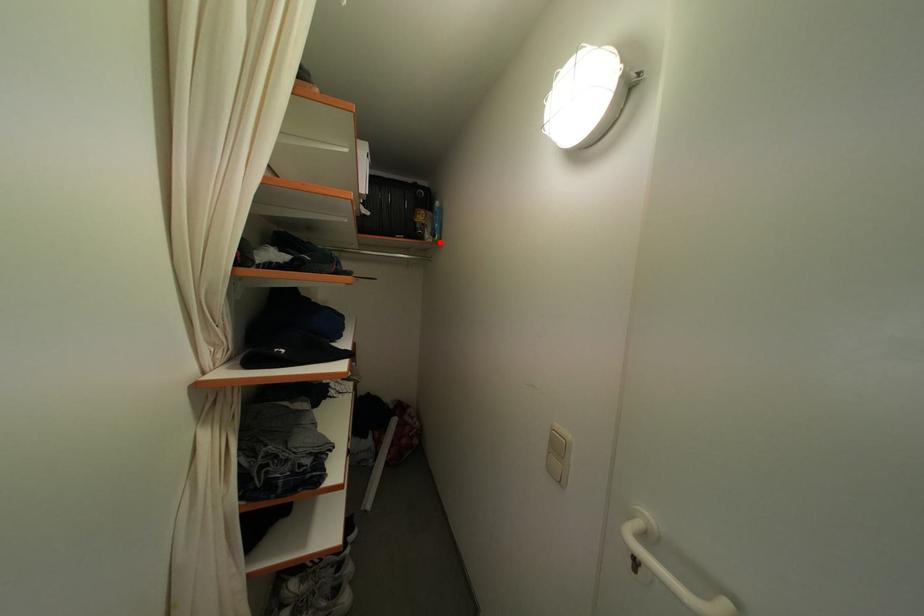
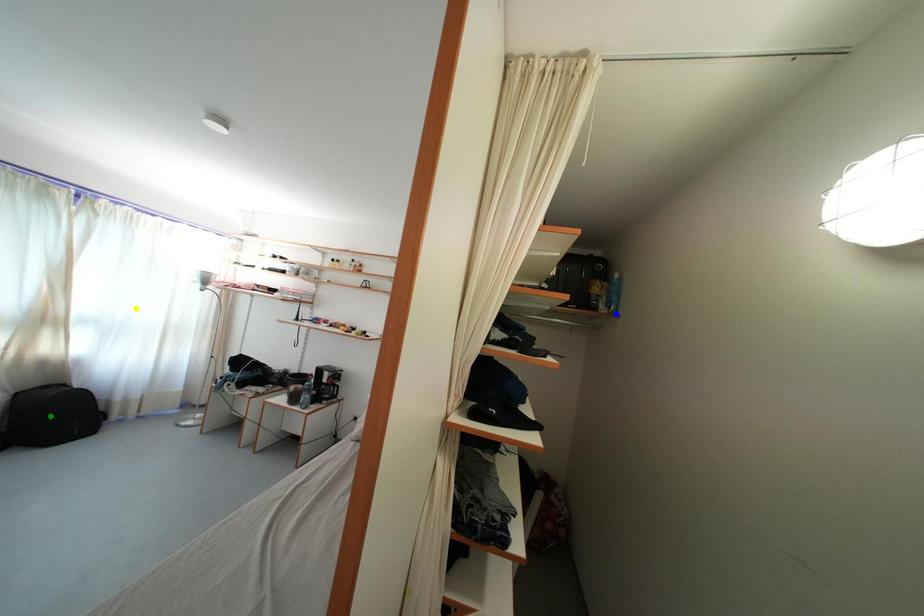
Question: I am providing you with two images of the same scene from different viewpoints. A red point is marked on the first image. You are given multiple points on the second image. Which mark in image 2 goes with the point in image 1?

Choices:
 (A) blue point
 (B) green point
 (C) yellow point

Answer: (A)